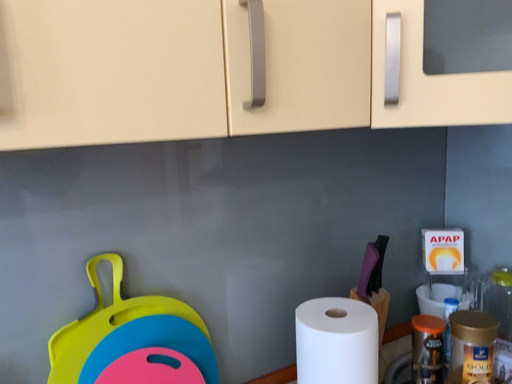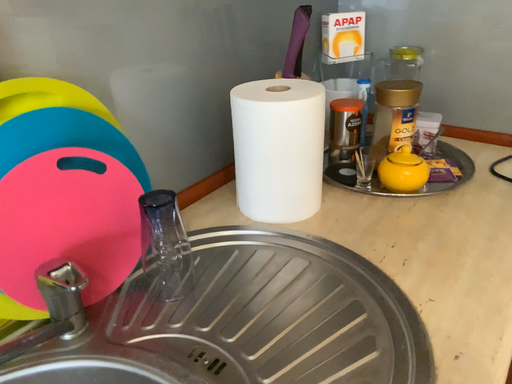
Question: Which way did the camera rotate in the video?

Choices:
 (A) rotated upward
 (B) rotated downward

Answer: (B)